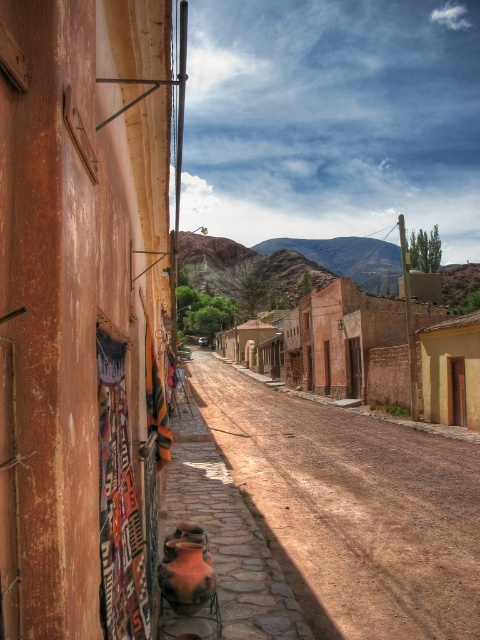
You are standing at the entrance of the weathered building with a reddish brown facade and want to walk to the end of the brown dirt track at center. Which direction should you head?

The brown dirt track at center is located at point (352, 508), so you should head towards the center of the image to reach the end of the brown dirt track at center.

You are standing at the entrance of the weathered building with the reddish brown facade in the village scene. You notice two points marked on the ground ahead of you. The first point is at coordinates point (407, 577) and the second is at point (334, 323). Which of these two points is closer to you?

Point (407, 577) is in front of point (334, 323), so it is closer to you.

You are a traveler on a narrow path in the village. You see the brown dirt track at center and the brown textured buildings at center. Which one takes up more space in the scene?

The brown textured buildings at center take up more space in the scene than the brown dirt track at center because the brown dirt track at center is smaller than brown textured buildings at center.